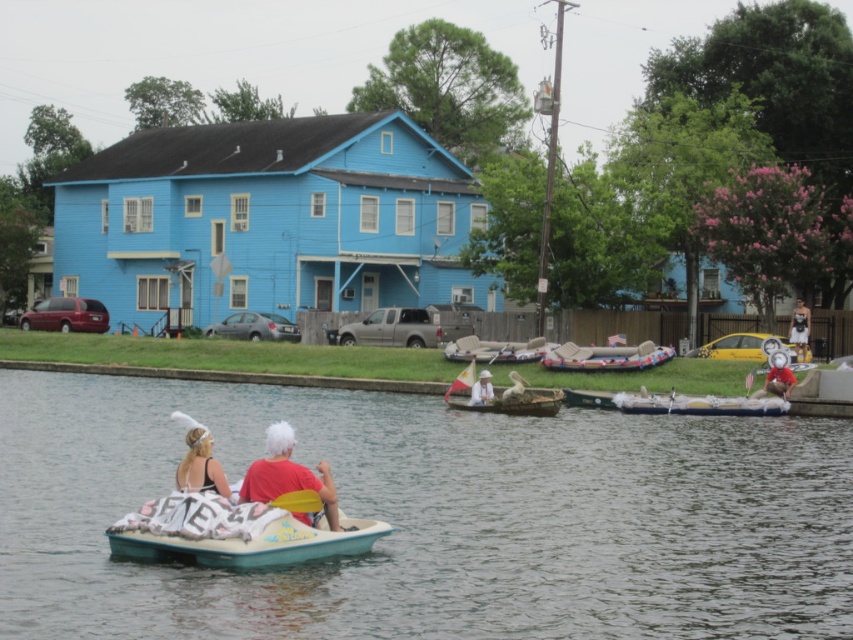
You are planning to cross the canal in a small boat. You see a teal plastic paddle boat at center and a white fluffy boat at center. Which boat is narrower and more suitable for navigating narrow waterways?

The teal plastic paddle boat at center is narrower than the white fluffy boat at center, making it more suitable for narrow waterways.

You are a photographer taking a picture of the two people in the boats. You want to ensure both the matte black swimsuit at lower left and the red cotton shirt at center are visible in the frame. Based on their positions, which one should you focus on first to capture both in the shot?

The matte black swimsuit at lower left is to the left of the red cotton shirt at center, so focusing on the red cotton shirt at center first would allow the photographer to include both in the frame since the swimsuit is positioned to the left of it.